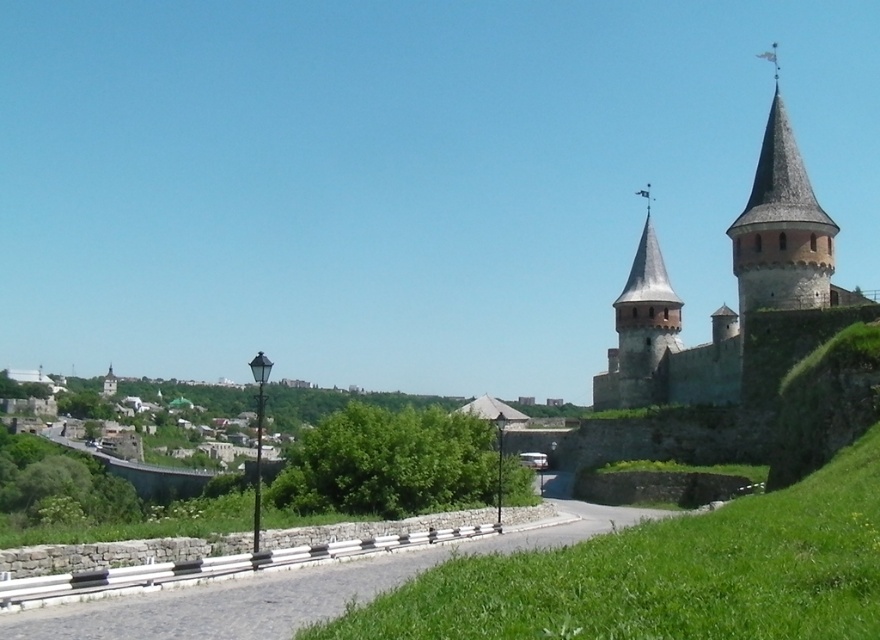
Question: Which of the following is the closest to the observer?

Choices:
 (A) (662, 390)
 (B) (392, 557)

Answer: (B)

Question: Is stone gray castle at upper right wider than gravel road at center?

Choices:
 (A) no
 (B) yes

Answer: (B)

Question: In this image, where is stone gray castle at upper right located relative to gravel road at center?

Choices:
 (A) above
 (B) below

Answer: (A)

Question: Which point appears closest to the camera in this image?

Choices:
 (A) (759, 243)
 (B) (103, 598)

Answer: (B)

Question: Is stone gray castle at upper right below gravel road at center?

Choices:
 (A) no
 (B) yes

Answer: (A)